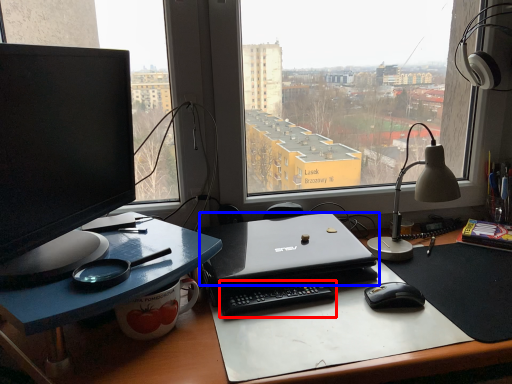
Question: Which of the following is the farthest to the observer, laptop keyboard (highlighted by a red box) or laptop (highlighted by a blue box)?

Choices:
 (A) laptop keyboard
 (B) laptop

Answer: (A)